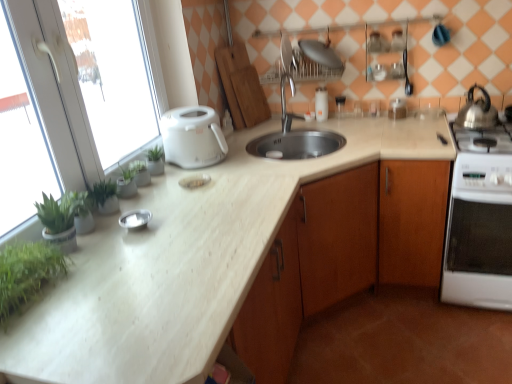
Question: Is point (286, 130) closer or farther from the camera than point (158, 102)?

Choices:
 (A) closer
 (B) farther

Answer: (B)

Question: In terms of size, does silver metallic faucet at center appear bigger or smaller than green leafy plant at left?

Choices:
 (A) small
 (B) big

Answer: (A)

Question: Estimate the real-world distances between objects in this image. Which object is closer to the green leafy plant at left?

Choices:
 (A) clear glass jars at upper center
 (B) white marble countertop at center
 (C) clear glass jar at upper right, the third appliance from the front
 (D) shiny metallic kettle at upper right, the first kitchen appliance viewed from the right
 (E) white glossy oven at right

Answer: (B)

Question: Which of these objects is positioned farthest from the green leafy plant at left?

Choices:
 (A) clear glass jar at upper right, which ranks as the second appliance in bottom-to-top order
 (B) shiny metallic kettle at upper right, which is the 2th kitchen appliance from left to right
 (C) green leafy plant at left
 (D) white glossy oven at right
 (E) white plastic toaster at left, the second kitchen appliance in the right-to-left sequence

Answer: (B)